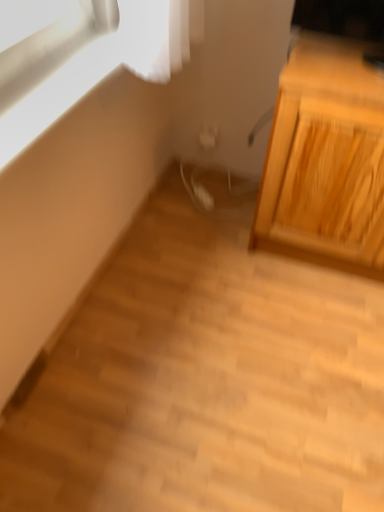
The image size is (384, 512). Identify the location of free location in front of light wood cabinet at right. (307, 322).